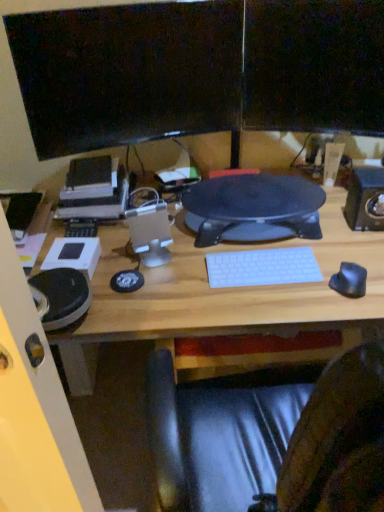
Identify the location of free space above white plastic keyboard at center (from a real-world perspective). (252, 246).